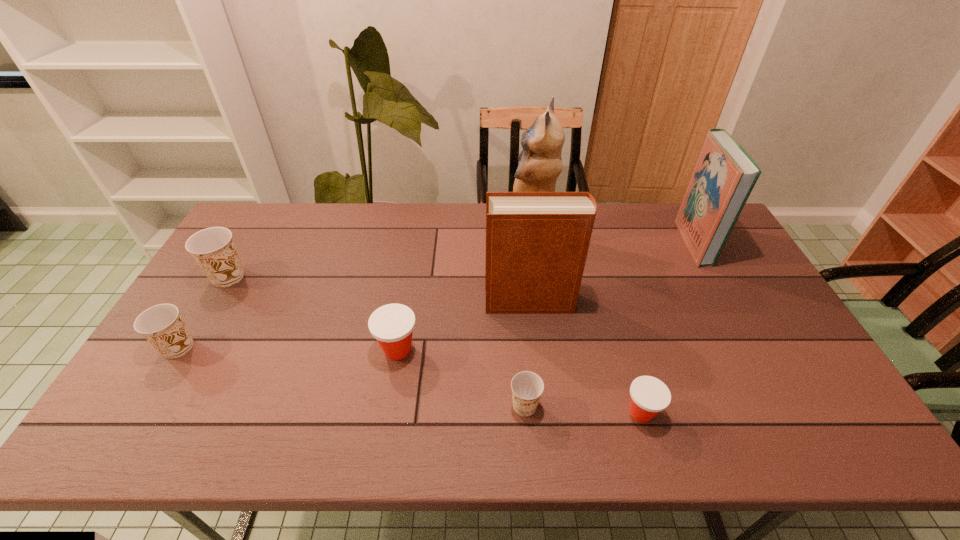
Find the location of a particular element. the smallest orange Dixie cup is located at coordinates pos(527,387).

At what (x,y) coordinates should I click in order to perform the action: click on the smaller red-orange Dixie cup. Please return your answer as a coordinate pair (x, y). This screenshot has width=960, height=540. Looking at the image, I should click on (649, 395).

The height and width of the screenshot is (540, 960). What are the coordinates of `the rightmost Dixie cup` in the screenshot? It's located at (649, 395).

Where is `vacant space situated 0.180m on the face of the cat`? The width and height of the screenshot is (960, 540). vacant space situated 0.180m on the face of the cat is located at coordinates (453, 234).

At what (x,y) coordinates should I click in order to perform the action: click on blank space located 0.180m on the face of the cat. Please return your answer as a coordinate pair (x, y). The image size is (960, 540). Looking at the image, I should click on (453, 234).

Image resolution: width=960 pixels, height=540 pixels. I want to click on free space located 0.390m on the face of the cat, so click(393, 234).

I want to click on free spot located 0.320m on the cover of the farther hardback book, so click(x=589, y=242).

I want to click on vacant area situated 0.170m on the cover of the farther hardback book, so click(634, 242).

Find the location of a particular element. The image size is (960, 540). free space located on the cover of the farther hardback book is located at coordinates (587, 242).

You are a GUI agent. You are given a task and a screenshot of the screen. Output one action in this format:
    pyautogui.click(x=<x>, y=<y>)
    Task: Click on the free point located on the open cover of the nearer hardback book
    
    Given the screenshot: What is the action you would take?
    pyautogui.click(x=404, y=301)